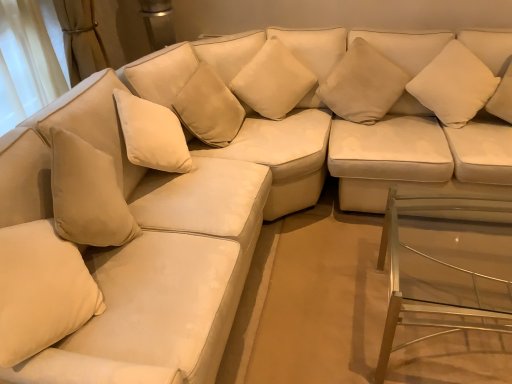
Describe the element at coordinates (273, 81) in the screenshot. I see `suede-like beige pillow at center, which ranks as the second pillow in left-to-right order` at that location.

How much space does beige fabric pillow at lower left, arranged as the 4th pillow when viewed from the right, occupy horizontally?

It is 10.06 inches.

The height and width of the screenshot is (384, 512). What are the coordinates of `clear glass table at lower right` in the screenshot? It's located at (445, 267).

Considering the positions of objects clear glass table at lower right and suede-like beige pillow at center, positioned as the 3th pillow in right-to-left order, in the image provided, who is behind, clear glass table at lower right or suede-like beige pillow at center, positioned as the 3th pillow in right-to-left order,?

suede-like beige pillow at center, positioned as the 3th pillow in right-to-left order, is further away from the camera.

Is clear glass table at lower right to the left or to the right of suede-like beige pillow at center, which ranks as the second pillow in left-to-right order, in the image?

Based on their positions, clear glass table at lower right is located to the right of suede-like beige pillow at center, which ranks as the second pillow in left-to-right order.

Is clear glass table at lower right completely or partially outside of suede-like beige pillow at center, positioned as the 3th pillow in right-to-left order?

Absolutely, clear glass table at lower right is external to suede-like beige pillow at center, positioned as the 3th pillow in right-to-left order.

From a real-world perspective, is clear glass table at lower right below suede-like beige pillow at center, positioned as the 3th pillow in right-to-left order?

Yes, from a real-world perspective, clear glass table at lower right is below suede-like beige pillow at center, positioned as the 3th pillow in right-to-left order.

How many degrees apart are the facing directions of beige fabric pillow at lower left, arranged as the 4th pillow when viewed from the right, and white soft cushion at upper right, the fourth pillow from the left?

The angular difference between beige fabric pillow at lower left, arranged as the 4th pillow when viewed from the right, and white soft cushion at upper right, the fourth pillow from the left, is 110 degrees.

At what (x,y) coordinates should I click in order to perform the action: click on pillow that is the 1st one below the white soft cushion at upper right, the fourth pillow from the left (from a real-world perspective). Please return your answer as a coordinate pair (x, y). Looking at the image, I should click on (41, 290).

Does beige fabric pillow at lower left, marked as the first pillow in a left-to-right arrangement, appear on the right side of white soft cushion at upper right, the fourth pillow from the left?

No.

Is point (85, 303) closer to camera compared to point (436, 88)?

Yes, it is.

Considering the positions of objects suede beige couch at left and clear glass table at lower right in the image provided, who is in front, suede beige couch at left or clear glass table at lower right?

Positioned in front is suede beige couch at left.

Locate an element on the screen. This screenshot has height=384, width=512. glass table below the suede beige couch at left (from a real-world perspective) is located at coordinates coord(445,267).

Is suede beige couch at left inside the boundaries of clear glass table at lower right, or outside?

suede beige couch at left is outside clear glass table at lower right.

From the image's perspective, does suede beige couch at left appear lower than clear glass table at lower right?

Incorrect, from the image's perspective, suede beige couch at left is higher than clear glass table at lower right.

Considering the positions of objects beige fabric pillow at upper center, which is the second pillow from right to left, and suede-like beige pillow at center, positioned as the 3th pillow in right-to-left order, in the image provided, who is more to the left, beige fabric pillow at upper center, which is the second pillow from right to left, or suede-like beige pillow at center, positioned as the 3th pillow in right-to-left order,?

From the viewer's perspective, suede-like beige pillow at center, positioned as the 3th pillow in right-to-left order, appears more on the left side.

From a real-world perspective, which pillow is the 3rd one underneath the suede-like beige pillow at center, which ranks as the second pillow in left-to-right order? Please provide its 2D coordinates.

[(362, 84)]

What's the angular difference between beige fabric pillow at upper center, positioned as the 3th pillow in left-to-right order, and suede-like beige pillow at center, which ranks as the second pillow in left-to-right order,'s facing directions?

The angular difference between beige fabric pillow at upper center, positioned as the 3th pillow in left-to-right order, and suede-like beige pillow at center, which ranks as the second pillow in left-to-right order, is 17.3 degrees.

Based on the photo, from a real-world perspective, which object stands above the other?

In real-world perspective, suede-like beige pillow at center, positioned as the 3th pillow in right-to-left order, is above.

From the picture: Considering the sizes of objects suede-like beige pillow at center, positioned as the 3th pillow in right-to-left order, and suede beige couch at left in the image provided, who is shorter, suede-like beige pillow at center, positioned as the 3th pillow in right-to-left order, or suede beige couch at left?

Standing shorter between the two is suede-like beige pillow at center, positioned as the 3th pillow in right-to-left order.

Would you say suede beige couch at left is part of suede-like beige pillow at center, positioned as the 3th pillow in right-to-left order,'s contents?

Actually, suede beige couch at left is outside suede-like beige pillow at center, positioned as the 3th pillow in right-to-left order.

Is point (256, 82) in front of point (207, 176)?

No, (256, 82) is behind (207, 176).

Is suede-like beige pillow at center, which ranks as the second pillow in left-to-right order, at the left side of suede beige couch at left?

Incorrect, suede-like beige pillow at center, which ranks as the second pillow in left-to-right order, is not on the left side of suede beige couch at left.

From the picture: Is the surface of suede-like beige pillow at center, positioned as the 3th pillow in right-to-left order, in direct contact with clear glass table at lower right?

They are not placed beside each other.

Is suede-like beige pillow at center, which ranks as the second pillow in left-to-right order, facing away from clear glass table at lower right?

No.

This screenshot has width=512, height=384. Identify the location of the 4th pillow above the clear glass table at lower right (from the image's perspective). (273, 81).

Considering the sizes of suede-like beige pillow at center, positioned as the 3th pillow in right-to-left order, and clear glass table at lower right in the image, is suede-like beige pillow at center, positioned as the 3th pillow in right-to-left order, taller or shorter than clear glass table at lower right?

In the image, suede-like beige pillow at center, positioned as the 3th pillow in right-to-left order, appears to be shorter than clear glass table at lower right.

From a real-world perspective, who is located lower, beige fabric pillow at lower left, marked as the first pillow in a left-to-right arrangement, or beige fabric pillow at upper center, positioned as the 3th pillow in left-to-right order?

beige fabric pillow at upper center, positioned as the 3th pillow in left-to-right order, from a real-world perspective.

Would you say beige fabric pillow at lower left, marked as the first pillow in a left-to-right arrangement, contains beige fabric pillow at upper center, positioned as the 3th pillow in left-to-right order?

No.

Is beige fabric pillow at lower left, arranged as the 4th pillow when viewed from the right, at the left side of beige fabric pillow at upper center, which is the second pillow from right to left?

Yes.

Find the location of `glass table located below the suede-like beige pillow at center, positioned as the 3th pillow in right-to-left order (from the image's perspective)`. glass table located below the suede-like beige pillow at center, positioned as the 3th pillow in right-to-left order (from the image's perspective) is located at coordinates (445, 267).

From a real-world perspective, which pillow is the 1st one underneath the white soft cushion at upper right, the fourth pillow from the left? Please provide its 2D coordinates.

[(41, 290)]

Consider the image. Based on their spatial positions, is beige fabric pillow at lower left, arranged as the 4th pillow when viewed from the right, or beige fabric pillow at upper center, which is the second pillow from right to left, further from suede beige couch at left?

beige fabric pillow at upper center, which is the second pillow from right to left, is positioned further to the anchor suede beige couch at left.

Estimate the real-world distances between objects in this image. Which object is closer to suede-like beige pillow at center, which ranks as the second pillow in left-to-right order, clear glass table at lower right or beige fabric pillow at upper center, which is the second pillow from right to left?

The object closer to suede-like beige pillow at center, which ranks as the second pillow in left-to-right order, is beige fabric pillow at upper center, which is the second pillow from right to left.

Looking at this image, based on their spatial positions, is clear glass table at lower right or white soft cushion at upper right, the fourth pillow from the left, closer to suede beige couch at left?

The object closer to suede beige couch at left is clear glass table at lower right.

When comparing their distances from beige fabric pillow at upper center, positioned as the 3th pillow in left-to-right order, does clear glass table at lower right or suede-like beige pillow at center, positioned as the 3th pillow in right-to-left order, seem closer?

The object closer to beige fabric pillow at upper center, positioned as the 3th pillow in left-to-right order, is suede-like beige pillow at center, positioned as the 3th pillow in right-to-left order.

Considering their positions, is suede-like beige pillow at center, positioned as the 3th pillow in right-to-left order, positioned further to suede beige couch at left than beige fabric pillow at upper center, positioned as the 3th pillow in left-to-right order?

Based on the image, beige fabric pillow at upper center, positioned as the 3th pillow in left-to-right order, appears to be further to suede beige couch at left.

Which object lies further to the anchor point beige fabric pillow at lower left, arranged as the 4th pillow when viewed from the right, white soft cushion at upper right, placed as the first pillow when sorted from right to left, or beige fabric pillow at upper center, which is the second pillow from right to left?

white soft cushion at upper right, placed as the first pillow when sorted from right to left, lies further to beige fabric pillow at lower left, arranged as the 4th pillow when viewed from the right, than the other object.

Looking at the image, which one is located closer to suede-like beige pillow at center, which ranks as the second pillow in left-to-right order, white soft cushion at upper right, placed as the first pillow when sorted from right to left, or clear glass table at lower right?

Based on the image, white soft cushion at upper right, placed as the first pillow when sorted from right to left, appears to be nearer to suede-like beige pillow at center, which ranks as the second pillow in left-to-right order.

Considering their positions, is clear glass table at lower right positioned further to white soft cushion at upper right, the fourth pillow from the left, than beige fabric pillow at upper center, positioned as the 3th pillow in left-to-right order?

The object further to white soft cushion at upper right, the fourth pillow from the left, is clear glass table at lower right.

The height and width of the screenshot is (384, 512). In order to click on glass table positioned between suede beige couch at left and suede-like beige pillow at center, which ranks as the second pillow in left-to-right order, from near to far in this screenshot , I will do `click(445, 267)`.

This screenshot has width=512, height=384. I want to click on pillow between suede-like beige pillow at center, positioned as the 3th pillow in right-to-left order, and white soft cushion at upper right, placed as the first pillow when sorted from right to left, so click(x=362, y=84).

Identify the location of glass table situated between suede beige couch at left and white soft cushion at upper right, the fourth pillow from the left, from left to right. (445, 267).

I want to click on glass table between beige fabric pillow at lower left, marked as the first pillow in a left-to-right arrangement, and white soft cushion at upper right, placed as the first pillow when sorted from right to left, from left to right, so click(x=445, y=267).